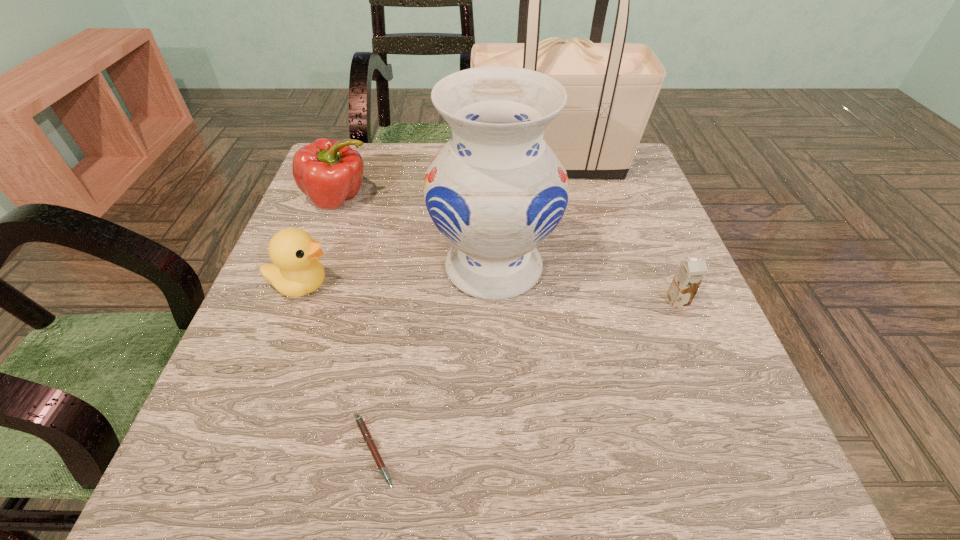
The width and height of the screenshot is (960, 540). I want to click on vacant space that satisfies the following two spatial constraints: 1. on the front side of the second shortest object; 2. on the left side of the vase, so tap(494, 301).

Locate an element on the screen. vacant space that satisfies the following two spatial constraints: 1. on the back side of the second shortest object; 2. with handles facing forward on the tallest object is located at coordinates (621, 164).

You are a GUI agent. You are given a task and a screenshot of the screen. Output one action in this format:
    pyautogui.click(x=<x>, y=<y>)
    Task: Click on the free space that satisfies the following two spatial constraints: 1. with handles facing forward on the second shortest object; 2. on the right side of the shopping bag
    This screenshot has width=960, height=540.
    Given the screenshot: What is the action you would take?
    click(579, 301)